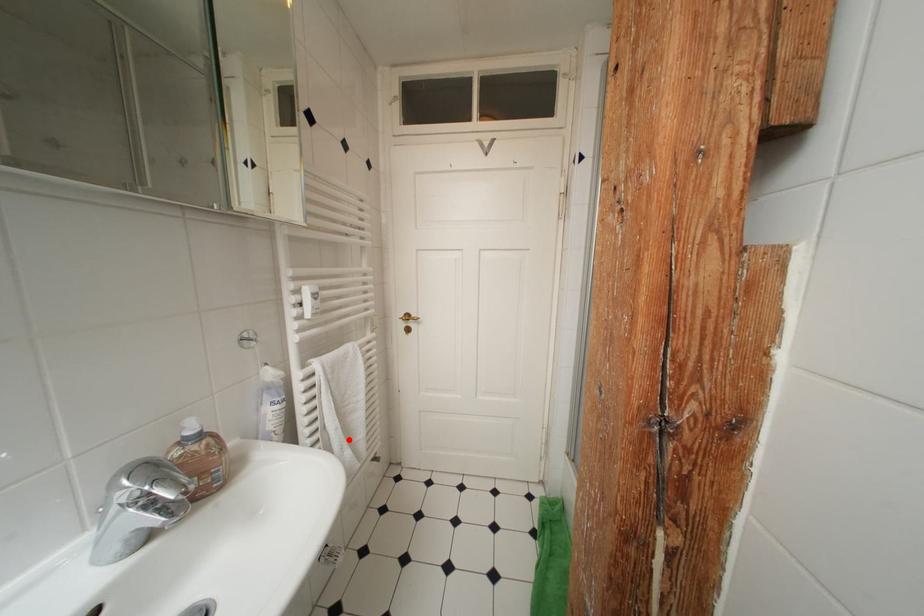
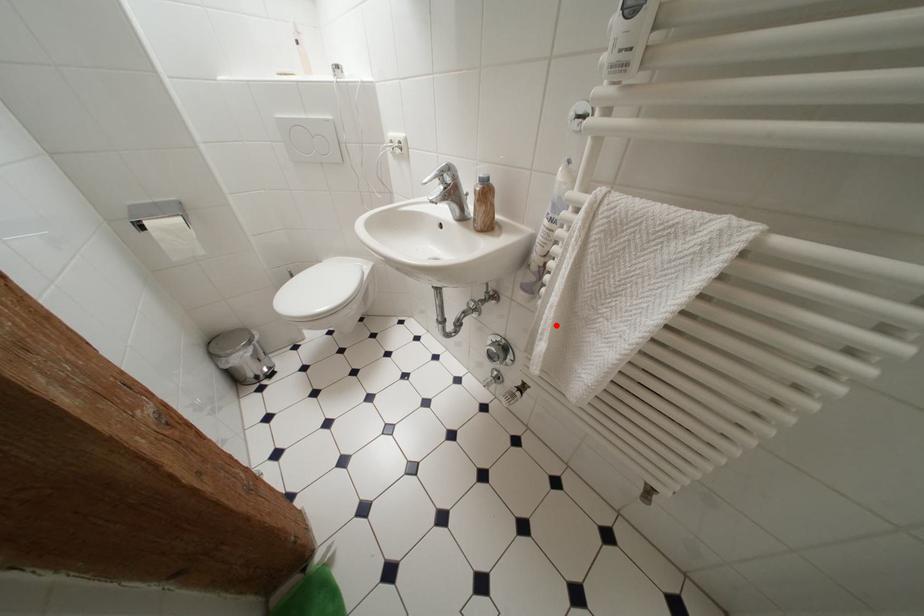
I am providing you with two images of the same scene from different viewpoints. A red point is marked on the first image and another point is marked on the second image. Does the point marked in image1 correspond to the same location as the one in image2?

Yes